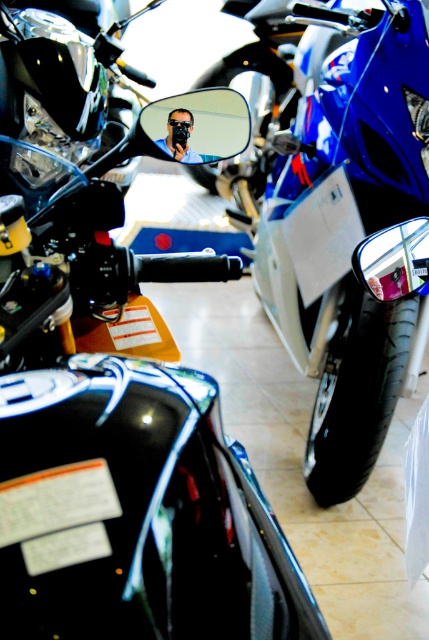
You are a photographer trying to capture both the blue glossy motorcycle at center and the matte black face mask at center in a single frame. Which object should you position closer to the camera to ensure both fit horizontally within the frame?

Since the blue glossy motorcycle at center is wider than the matte black face mask at center, you should position the blue glossy motorcycle at center closer to the camera. This will help balance their sizes in the frame, ensuring both fit horizontally.

You are a customer in the motorcycle showroom and want to see both the blue glossy motorcycle at center and the matte black face mask at center. Which object is closer to you?

The blue glossy motorcycle at center is closer to you than the matte black face mask at center because the matte black face mask at center is behind the blue glossy motorcycle at center.

You are a photographer trying to capture both the blue glossy motorcycle at center and the matte black face mask at center in a single shot. Given their size difference, which object will appear bigger in the photo?

The blue glossy motorcycle at center will appear bigger in the photo since it has a larger size compared to the matte black face mask at center.